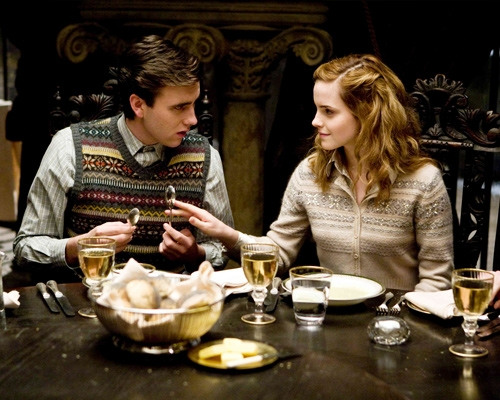
In order to click on white plate in this screenshot , I will do `click(353, 290)`.